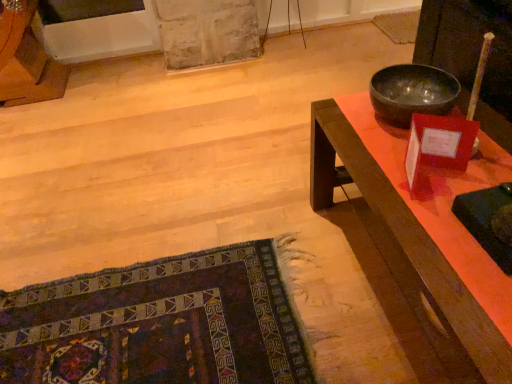
This screenshot has width=512, height=384. What are the coordinates of `vacant area that is in front of shiny metallic bowl at upper right` in the screenshot? It's located at (428, 165).